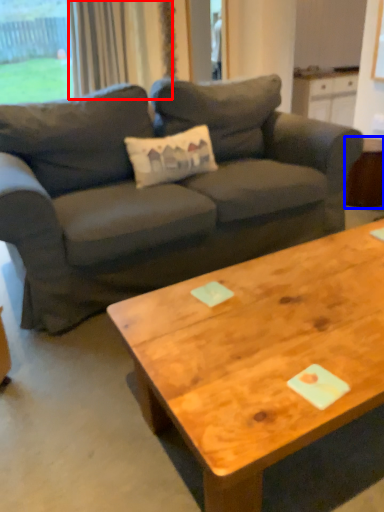
Question: Which of the following is the farthest to the observer, curtain (highlighted by a red box) or side table (highlighted by a blue box)?

Choices:
 (A) curtain
 (B) side table

Answer: (A)